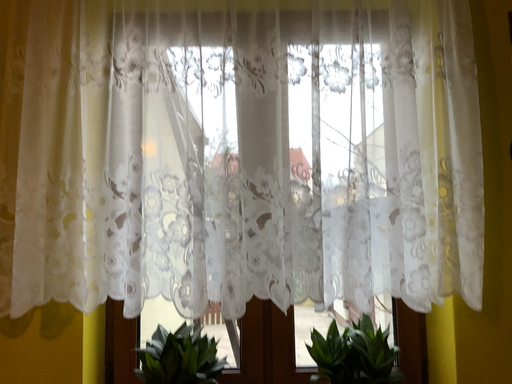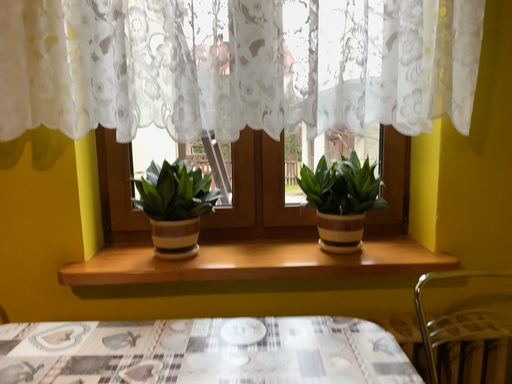
Question: Which way did the camera rotate in the video?

Choices:
 (A) rotated downward
 (B) rotated upward

Answer: (A)